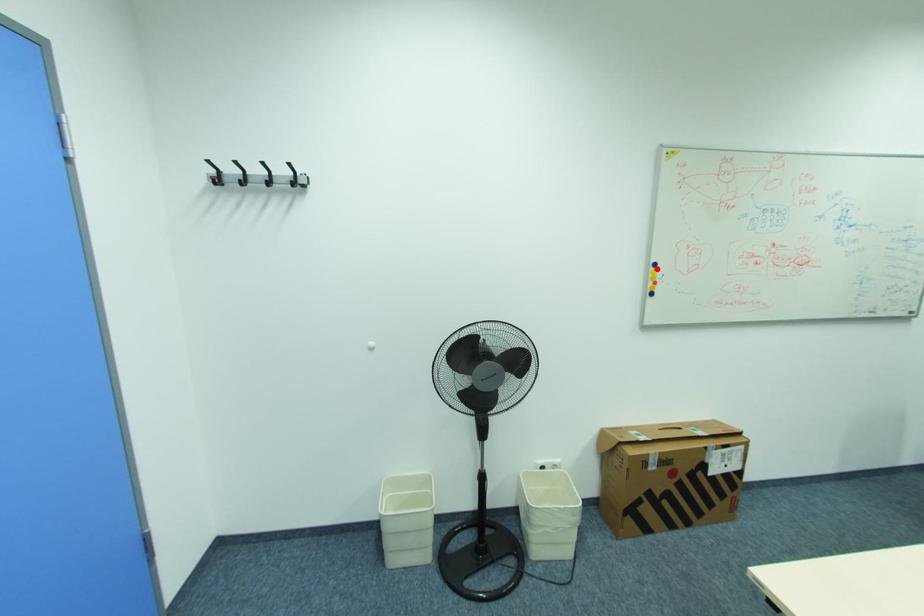
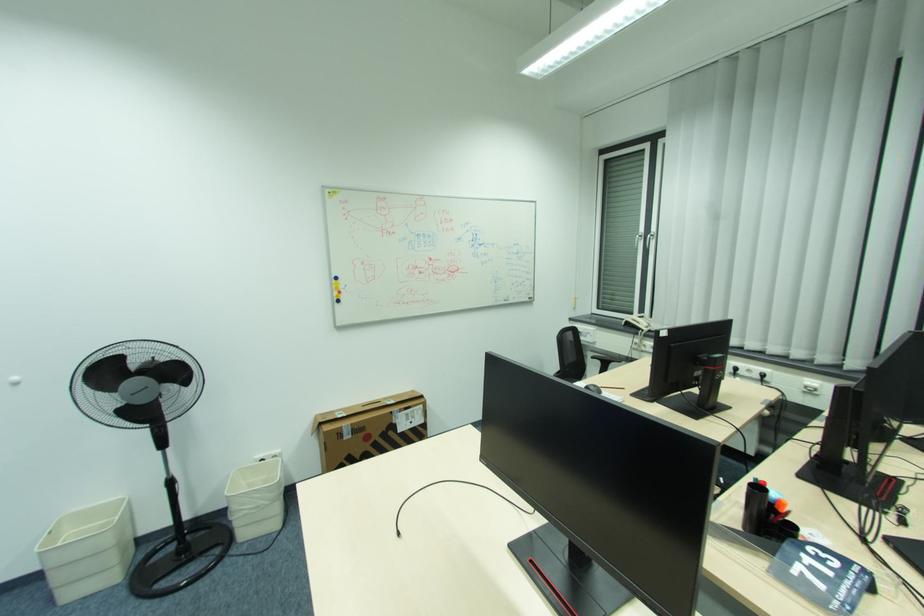
Find the pixel in the second image that matches the highlighted location in the first image.

(339, 282)